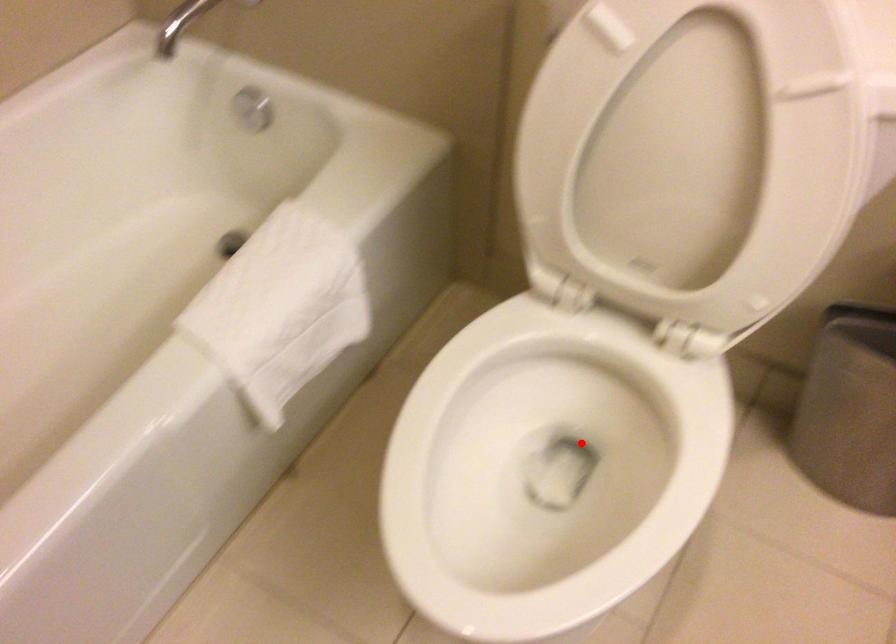
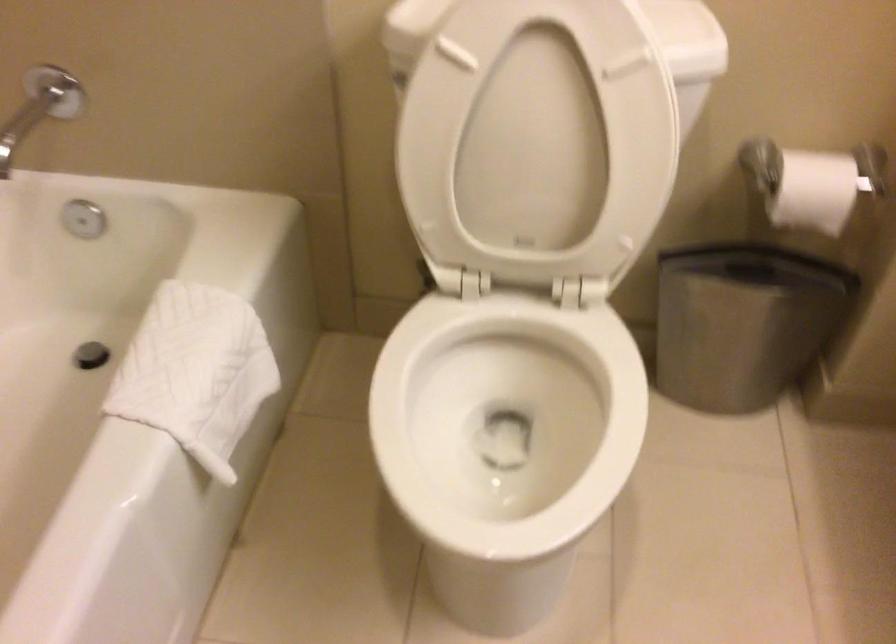
Where in the second image is the point corresponding to the highlighted location from the first image?

(505, 420)